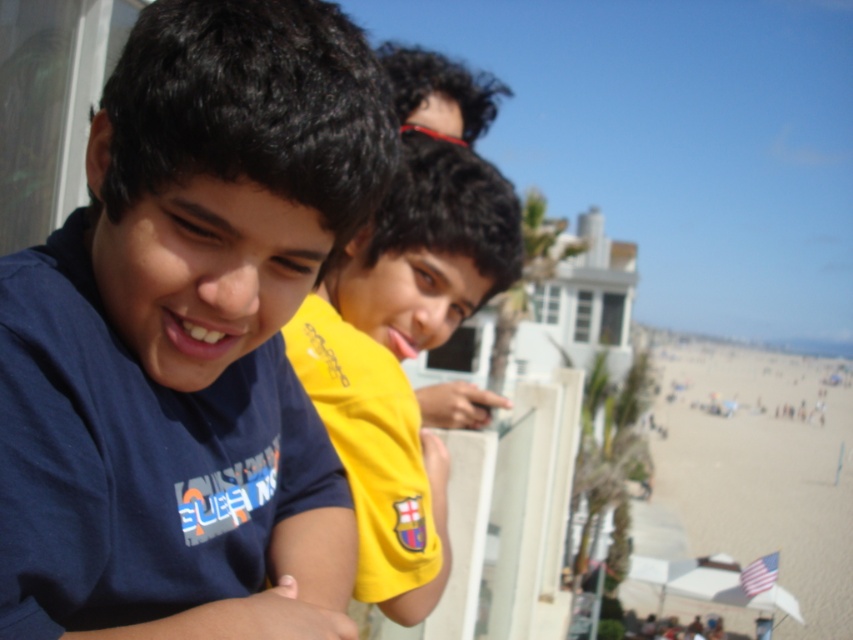
You are standing at the edge of the beach looking at two points marked on the image. Which point, point (274,80) or point (397,180), is closer to you?

Point (274,80) is closer to the viewer than point (397,180).

You are standing at the center of the beach scene. You need to locate the blue cotton shirt at left. Which direction should you look to find it?

You should look to the left side to find the blue cotton shirt at left since it is located at point (187, 332), which is on the left side of the scene.

You are a photographer trying to capture a photo of the beach scene. You want to ensure both the blue cotton shirt at left and the yellow jersey at center are clearly visible in your shot. Based on their heights, which one might you need to adjust your camera angle to focus on?

The blue cotton shirt at left is shorter than the yellow jersey at center, so you might need to lower your camera angle to ensure the shorter blue cotton shirt at left is visible while still capturing the taller yellow jersey at center.